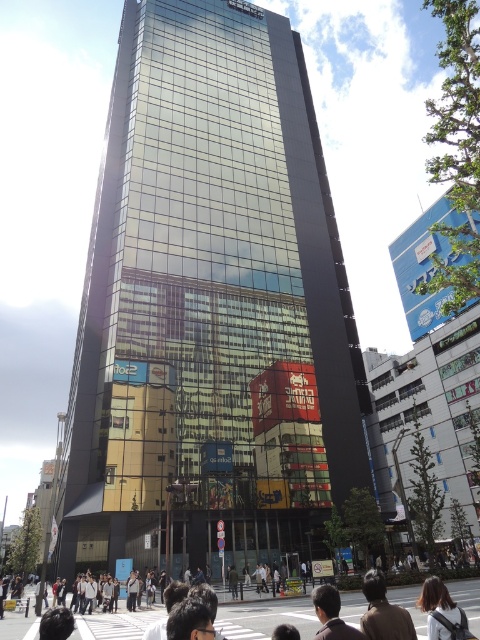
You are standing in front of the skyscraper and want to reach a point that is exactly 16.39 meters away from your current position. You see a point marked at coordinates point [464,627] in the image. Can you determine if this point is the correct location to reach?

Answer: The point [464,627] is exactly 16.39 meters away from the viewer, so yes, reaching this point will place you at the desired distance of 16.39 meters from your current position.

You are a pedestrian standing in front of the skyscraper. You see a brown leather jacket at lower center and a dark brown hair at lower center. Which object is positioned to the right side?

The brown leather jacket at lower center is to the right of the dark brown hair at lower center.